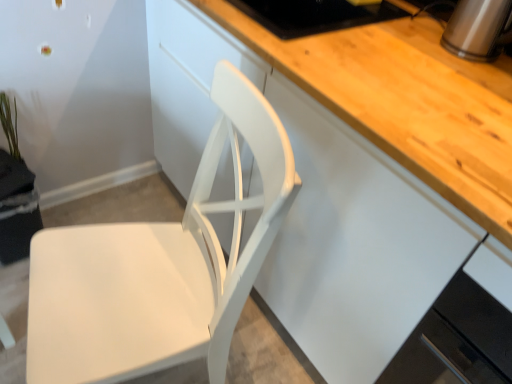
Question: From the image's perspective, is green matte plant at upper left located above or below white glossy cabinet at lower right, the 1th cabinetry ordered from the bottom?

Choices:
 (A) below
 (B) above

Answer: (B)

Question: Based on their sizes in the image, would you say green matte plant at upper left is bigger or smaller than white glossy cabinet at lower right, which ranks as the 2th cabinetry in top-to-bottom order?

Choices:
 (A) small
 (B) big

Answer: (A)

Question: Which of these objects is positioned farthest from the white matte chair at center?

Choices:
 (A) green matte plant at upper left
 (B) satin silver kettle at upper right
 (C) white matte cabinet at center, the second cabinetry when ordered from bottom to top
 (D) white glossy cabinet at lower right, the 1th cabinetry ordered from the bottom

Answer: (B)

Question: Estimate the real-world distances between objects in this image. Which object is closer to the green matte plant at upper left?

Choices:
 (A) satin silver kettle at upper right
 (B) white matte cabinet at center, which appears as the 1th cabinetry when viewed from the top
 (C) white glossy cabinet at lower right, the 1th cabinetry ordered from the bottom
 (D) white matte chair at center

Answer: (D)